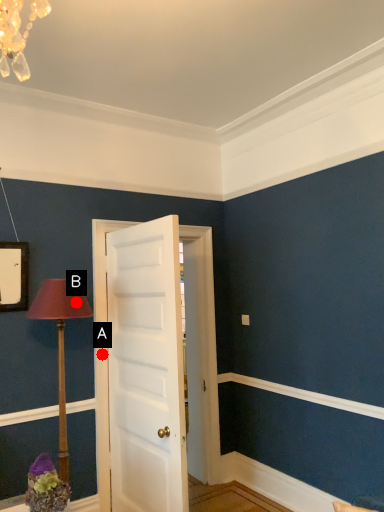
Question: Two points are circled on the image, labeled by A and B beside each circle. Which of the following is the closest to the observer?

Choices:
 (A) A is closer
 (B) B is closer

Answer: (B)